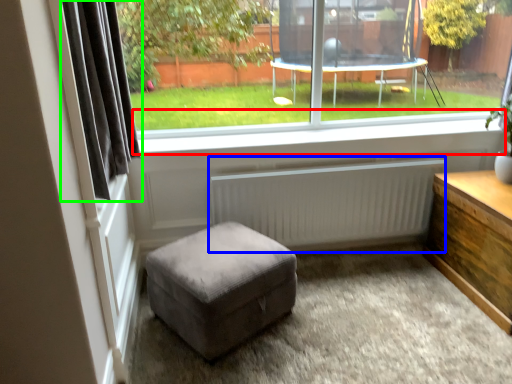
Question: Which is farther away from window sill (highlighted by a red box)? radiator (highlighted by a blue box) or curtain (highlighted by a green box)?

Choices:
 (A) radiator
 (B) curtain

Answer: (B)